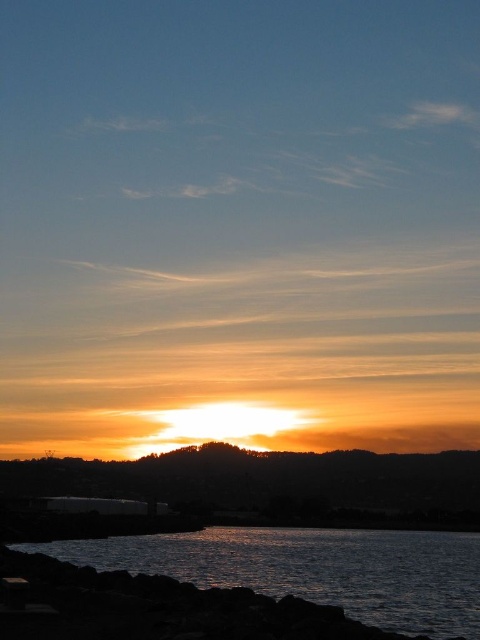
Question: Is golden sky at center smaller than dark reflective water at lower left?

Choices:
 (A) no
 (B) yes

Answer: (A)

Question: Is golden sky at center above dark reflective water at lower left?

Choices:
 (A) yes
 (B) no

Answer: (B)

Question: Is golden sky at center to the right of dark reflective water at lower left from the viewer's perspective?

Choices:
 (A) yes
 (B) no

Answer: (B)

Question: Which of the following is the closest to the observer?

Choices:
 (A) (183, 561)
 (B) (287, 481)

Answer: (A)

Question: Which point is closer to the camera?

Choices:
 (A) dark reflective water at lower left
 (B) golden sky at center

Answer: (A)